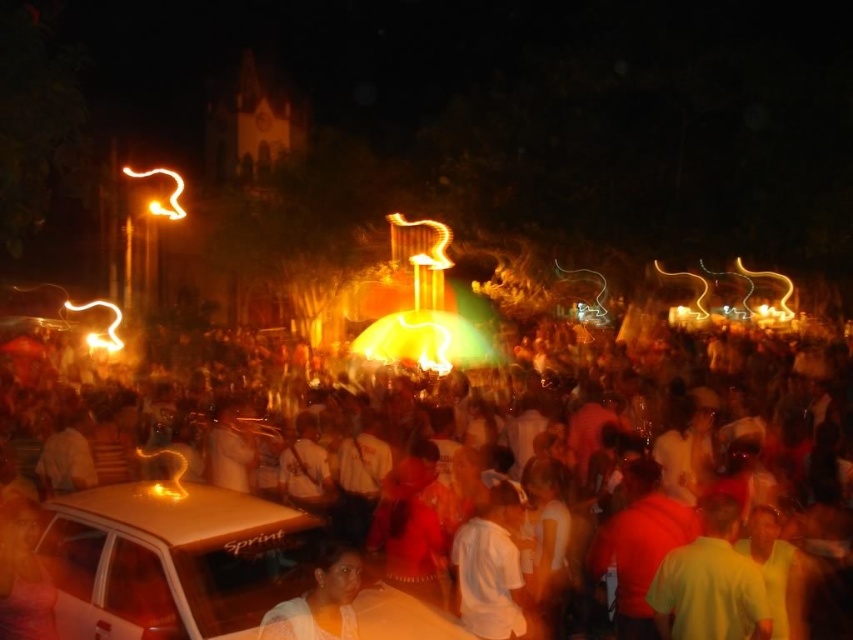
Question: Estimate the real-world distances between objects in this image. Which object is farther from the matte orange crowd at center?

Choices:
 (A) smooth skin face at lower center
 (B) shiny gold car at lower left

Answer: (A)

Question: Observing the image, what is the correct spatial positioning of shiny gold car at lower left in reference to smooth skin face at lower center?

Choices:
 (A) below
 (B) above

Answer: (B)

Question: Is matte orange crowd at center wider than smooth skin face at lower center?

Choices:
 (A) no
 (B) yes

Answer: (B)

Question: Which point is closer to the camera?

Choices:
 (A) smooth skin face at lower center
 (B) matte orange crowd at center

Answer: (B)

Question: Can you confirm if shiny gold car at lower left is positioned to the left of smooth skin face at lower center?

Choices:
 (A) yes
 (B) no

Answer: (A)

Question: Which point is farther from the camera taking this photo?

Choices:
 (A) (247, 499)
 (B) (335, 589)
 (C) (134, 579)

Answer: (A)